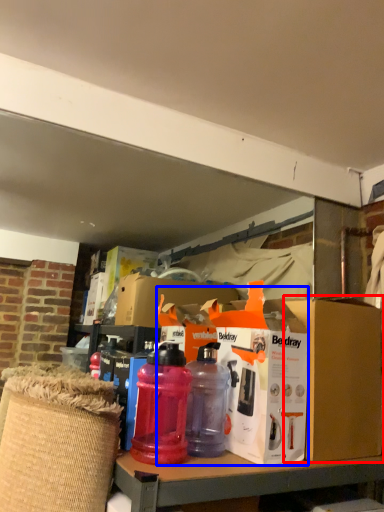
Question: Which object appears closest to the camera in this image, cardboard box (highlighted by a red box) or box (highlighted by a blue box)?

Choices:
 (A) cardboard box
 (B) box

Answer: (B)